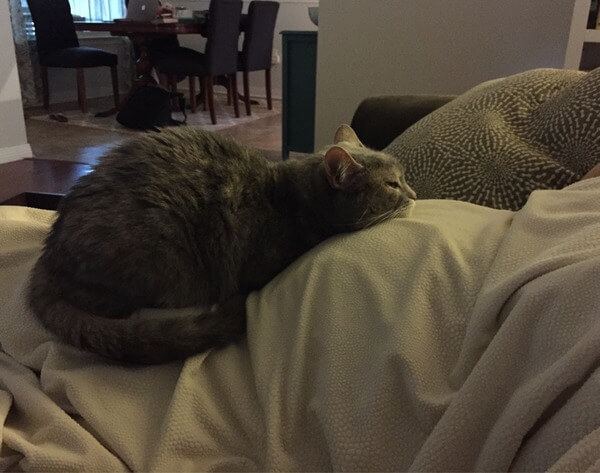
Where is `wall`? wall is located at coordinates (378, 35).